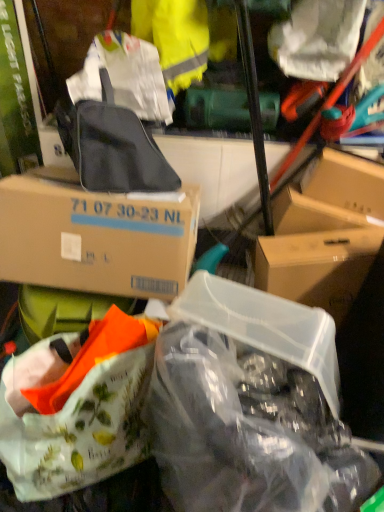
Question: Is white fabric handbag at lower left bigger or smaller than matte black backpack at upper center?

Choices:
 (A) small
 (B) big

Answer: (B)

Question: Is white fabric handbag at lower left inside the boundaries of matte black backpack at upper center, or outside?

Choices:
 (A) inside
 (B) outside

Answer: (B)

Question: Which of these objects is positioned closest to the transparent plastic container at center-right, the second box when ordered from left to right?

Choices:
 (A) transparent plastic bag at center, which appears as the 2th plastic bag when viewed from the top
 (B) white fabric handbag at lower left
 (C) matte black backpack at upper center
 (D) yellow fabric at upper center
 (E) white matte plastic bag at upper right, positioned as the first plastic bag in top-to-bottom order

Answer: (A)

Question: Which of these objects is positioned farthest from the transparent plastic bag at center, which is the 1th plastic bag in bottom-to-top order?

Choices:
 (A) brown cardboard box at upper left, marked as the 2th box in a right-to-left arrangement
 (B) transparent plastic container at center-right, which is the 1th box in right-to-left order
 (C) yellow fabric at upper center
 (D) white matte plastic bag at upper right, which is the second plastic bag in bottom-to-top order
 (E) white fabric handbag at lower left

Answer: (C)